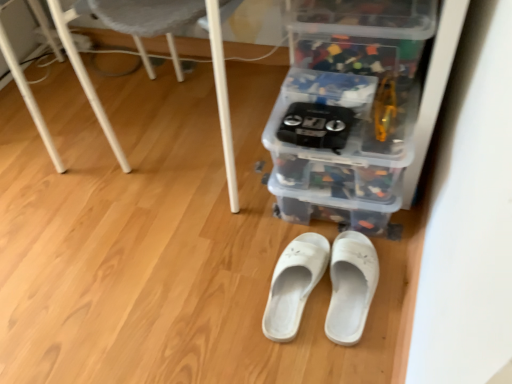
Image resolution: width=512 pixels, height=384 pixels. I want to click on free region on the left part of clear plastic storage box at center, which ranks as the third storage box in top-to-bottom order, so click(239, 223).